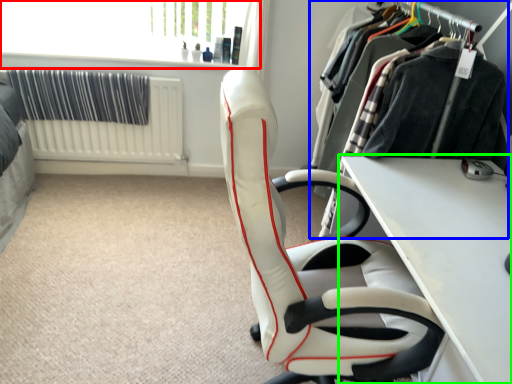
Question: Considering the real-world distances, which object is closest to window screen (highlighted by a red box)? closet (highlighted by a blue box) or table (highlighted by a green box).

Choices:
 (A) closet
 (B) table

Answer: (A)